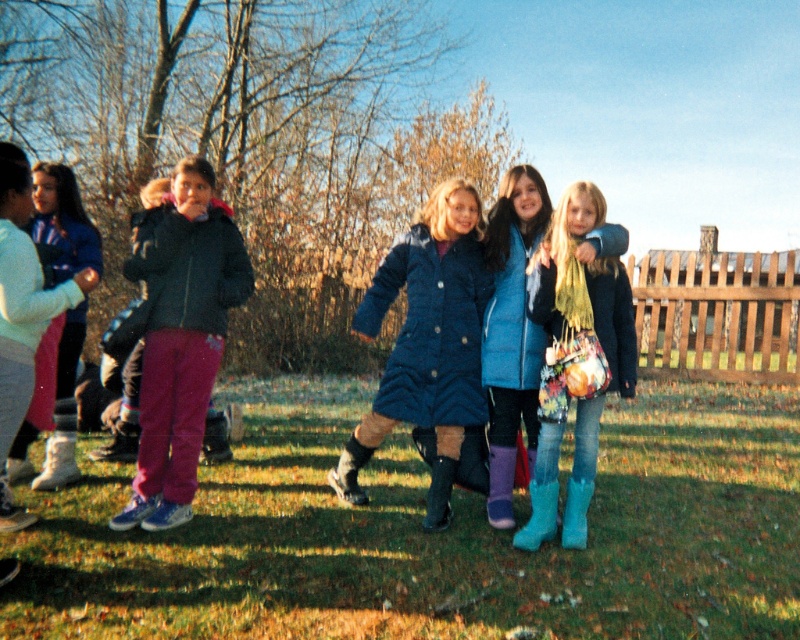
Question: Which object is the closest to the matte black jacket at left?

Choices:
 (A) white suede boot at lower left
 (B) green grass at lower center
 (C) quilted blue coat at center

Answer: (A)

Question: Is leather boot at center above matte black boot at center?

Choices:
 (A) yes
 (B) no

Answer: (A)

Question: Which object is closer to the camera taking this photo?

Choices:
 (A) blue rubber boot at center
 (B) leather boot at center

Answer: (A)

Question: Which object is positioned farthest from the matte black boot at center?

Choices:
 (A) leather boot at center
 (B) green grass at lower center
 (C) white suede boot at lower left

Answer: (C)

Question: Does blue rubber boot at lower right have a larger size compared to white suede boot at lower left?

Choices:
 (A) yes
 (B) no

Answer: (B)

Question: Does blue rubber boot at center appear on the left side of blue rubber boot at lower right?

Choices:
 (A) yes
 (B) no

Answer: (A)